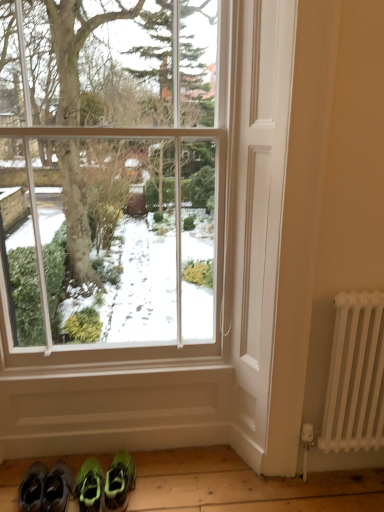
What do you see at coordinates (119, 482) in the screenshot? I see `green synthetic sneakers at lower center, the first footwear positioned from the right` at bounding box center [119, 482].

The image size is (384, 512). Describe the element at coordinates (57, 488) in the screenshot. I see `green suede sneakers at lower left, which is the first footwear from left to right` at that location.

This screenshot has height=512, width=384. I want to click on green suede sneakers at lower left, the third footwear viewed from the right, so click(x=57, y=488).

What do you see at coordinates (355, 375) in the screenshot? I see `white metal radiator at right` at bounding box center [355, 375].

Find the location of a particular element. This screenshot has height=512, width=384. white metal radiator at right is located at coordinates pos(355,375).

The height and width of the screenshot is (512, 384). What are the coordinates of `green suede sneakers at lower left, the second footwear in the right-to-left sequence` in the screenshot? It's located at (89, 486).

The image size is (384, 512). In order to click on green synthetic sneakers at lower center, the first footwear positioned from the right in this screenshot , I will do `click(119, 482)`.

Does green synthetic sneakers at lower center, the first footwear positioned from the right, turn towards green suede sneakers at lower left, which is the first footwear from left to right?

No, green synthetic sneakers at lower center, the first footwear positioned from the right, is not aimed at green suede sneakers at lower left, which is the first footwear from left to right.

Which point is more forward, (x=115, y=489) or (x=53, y=470)?

Positioned in front is point (x=115, y=489).

The height and width of the screenshot is (512, 384). What are the coordinates of `radiator on the right of the green suede sneakers at lower left, which is the first footwear from left to right` in the screenshot? It's located at (355, 375).

Is green suede sneakers at lower left, which is the first footwear from left to right, facing away from white metal radiator at right?

No, green suede sneakers at lower left, which is the first footwear from left to right, is not facing away from white metal radiator at right.

What's the angular difference between green suede sneakers at lower left, which is the first footwear from left to right, and white metal radiator at right's facing directions?

6.03 degrees.

Does green suede sneakers at lower left, which is the first footwear from left to right, have a greater height compared to white metal radiator at right?

Incorrect, the height of green suede sneakers at lower left, which is the first footwear from left to right, is not larger of that of white metal radiator at right.

In the image, is white metal radiator at right on the left side or the right side of green suede sneakers at lower left, the second footwear in the right-to-left sequence?

In the image, white metal radiator at right appears on the right side of green suede sneakers at lower left, the second footwear in the right-to-left sequence.

Is white metal radiator at right far from green suede sneakers at lower left, the second footwear in the right-to-left sequence?

Absolutely, white metal radiator at right is distant from green suede sneakers at lower left, the second footwear in the right-to-left sequence.

Could green suede sneakers at lower left, the second footwear in the right-to-left sequence, be considered to be inside white metal radiator at right?

No, white metal radiator at right does not contain green suede sneakers at lower left, the second footwear in the right-to-left sequence.

From the image's perspective, is green suede sneakers at lower left, the second footwear in the right-to-left sequence, above or below white metal radiator at right?

green suede sneakers at lower left, the second footwear in the right-to-left sequence, is situated lower than white metal radiator at right in the image.

In the scene shown: Considering the relative sizes of green suede sneakers at lower left, the second footwear in the right-to-left sequence, and white metal radiator at right in the image provided, is green suede sneakers at lower left, the second footwear in the right-to-left sequence, bigger than white metal radiator at right?

Incorrect, green suede sneakers at lower left, the second footwear in the right-to-left sequence, is not larger than white metal radiator at right.

The height and width of the screenshot is (512, 384). Find the location of `radiator in front of the green suede sneakers at lower left, the second footwear in the right-to-left sequence`. radiator in front of the green suede sneakers at lower left, the second footwear in the right-to-left sequence is located at coordinates (355, 375).

Could you tell me if green suede sneakers at lower left, the second footwear in the right-to-left sequence, is turned towards white metal radiator at right?

No.

Is white metal radiator at right further to camera compared to green synthetic sneakers at lower center, the first footwear positioned from the right?

No, it is in front of green synthetic sneakers at lower center, the first footwear positioned from the right.

From the picture: From the image's perspective, is white metal radiator at right above or below green synthetic sneakers at lower center, the first footwear positioned from the right?

Based on their image positions, white metal radiator at right is located above green synthetic sneakers at lower center, the first footwear positioned from the right.

From a real-world perspective, is white metal radiator at right located higher than green synthetic sneakers at lower center, marked as the third footwear in a left-to-right arrangement?

Correct, in the physical world, white metal radiator at right is higher than green synthetic sneakers at lower center, marked as the third footwear in a left-to-right arrangement.

Considering the positions of point (329, 399) and point (127, 463), is point (329, 399) closer or farther from the camera than point (127, 463)?

Point (329, 399) is closer to the camera than point (127, 463).

Image resolution: width=384 pixels, height=512 pixels. In the image, there is a green suede sneakers at lower left, the third footwear viewed from the right. Identify the location of footwear below it (from the image's perspective). (89, 486).

Between green suede sneakers at lower left, the second footwear in the right-to-left sequence, and green suede sneakers at lower left, which is the first footwear from left to right, which one has larger width?

Wider between the two is green suede sneakers at lower left, the second footwear in the right-to-left sequence.

Based on their positions, is green suede sneakers at lower left, which appears as the 2th footwear when viewed from the left, located to the left or right of green suede sneakers at lower left, which is the first footwear from left to right?

green suede sneakers at lower left, which appears as the 2th footwear when viewed from the left, is to the right of green suede sneakers at lower left, which is the first footwear from left to right.

Considering the relative sizes of green suede sneakers at lower left, which is the first footwear from left to right, and green suede sneakers at lower left, which appears as the 2th footwear when viewed from the left, in the image provided, is green suede sneakers at lower left, which is the first footwear from left to right, bigger than green suede sneakers at lower left, which appears as the 2th footwear when viewed from the left,?

Yes, green suede sneakers at lower left, which is the first footwear from left to right, is bigger than green suede sneakers at lower left, which appears as the 2th footwear when viewed from the left.

The width and height of the screenshot is (384, 512). What are the coordinates of `footwear to the left of green suede sneakers at lower left, the second footwear in the right-to-left sequence` in the screenshot? It's located at (57, 488).

Considering their positions, is green suede sneakers at lower left, the third footwear viewed from the right, located in front of or behind green suede sneakers at lower left, the second footwear in the right-to-left sequence?

Clearly, green suede sneakers at lower left, the third footwear viewed from the right, is in front of green suede sneakers at lower left, the second footwear in the right-to-left sequence.

From the image's perspective, which is above, green suede sneakers at lower left, the third footwear viewed from the right, or green suede sneakers at lower left, which appears as the 2th footwear when viewed from the left?

green suede sneakers at lower left, the third footwear viewed from the right, is shown above in the image.

Where is `the 2nd footwear behind the green suede sneakers at lower left, which is the first footwear from left to right, counting from the anchor's position`? This screenshot has width=384, height=512. the 2nd footwear behind the green suede sneakers at lower left, which is the first footwear from left to right, counting from the anchor's position is located at coordinates (119, 482).

This screenshot has width=384, height=512. Identify the location of the 1st footwear below the white metal radiator at right (from a real-world perspective). 57,488.

Which object lies further to the anchor point green suede sneakers at lower left, which is the first footwear from left to right, green synthetic sneakers at lower center, marked as the third footwear in a left-to-right arrangement, or white metal radiator at right?

Based on the image, white metal radiator at right appears to be further to green suede sneakers at lower left, which is the first footwear from left to right.

Based on their spatial positions, is white metal radiator at right or green suede sneakers at lower left, which is the first footwear from left to right, closer to green suede sneakers at lower left, the second footwear in the right-to-left sequence?

green suede sneakers at lower left, which is the first footwear from left to right, lies closer to green suede sneakers at lower left, the second footwear in the right-to-left sequence, than the other object.

When comparing their distances from white metal radiator at right, does clear glass window at center or green suede sneakers at lower left, the second footwear in the right-to-left sequence, seem further?

The object further to white metal radiator at right is green suede sneakers at lower left, the second footwear in the right-to-left sequence.

When comparing their distances from clear glass window at center, does green synthetic sneakers at lower center, the first footwear positioned from the right, or green suede sneakers at lower left, the second footwear in the right-to-left sequence, seem closer?

green synthetic sneakers at lower center, the first footwear positioned from the right, is closer to clear glass window at center.

Based on their spatial positions, is green suede sneakers at lower left, the third footwear viewed from the right, or white metal radiator at right further from clear glass window at center?

Based on the image, green suede sneakers at lower left, the third footwear viewed from the right, appears to be further to clear glass window at center.

When comparing their distances from green suede sneakers at lower left, the second footwear in the right-to-left sequence, does white metal radiator at right or clear glass window at center seem closer?

white metal radiator at right is closer to green suede sneakers at lower left, the second footwear in the right-to-left sequence.

Looking at the image, which one is located further to green synthetic sneakers at lower center, marked as the third footwear in a left-to-right arrangement, white metal radiator at right or green suede sneakers at lower left, the third footwear viewed from the right?

Among the two, white metal radiator at right is located further to green synthetic sneakers at lower center, marked as the third footwear in a left-to-right arrangement.

Which object lies nearer to the anchor point green suede sneakers at lower left, which is the first footwear from left to right, green synthetic sneakers at lower center, the first footwear positioned from the right, or clear glass window at center?

green synthetic sneakers at lower center, the first footwear positioned from the right, is closer to green suede sneakers at lower left, which is the first footwear from left to right.

Locate an element on the screen. This screenshot has width=384, height=512. window between green suede sneakers at lower left, which is the first footwear from left to right, and white metal radiator at right, in the horizontal direction is located at coordinates (113, 174).

Where is `window between green suede sneakers at lower left, the second footwear in the right-to-left sequence, and white metal radiator at right from left to right`? The height and width of the screenshot is (512, 384). window between green suede sneakers at lower left, the second footwear in the right-to-left sequence, and white metal radiator at right from left to right is located at coordinates (113, 174).

You are a GUI agent. You are given a task and a screenshot of the screen. Output one action in this format:
    pyautogui.click(x=<x>, y=<y>)
    Task: Click on the footwear between green suede sneakers at lower left, which is the first footwear from left to right, and green synthetic sneakers at lower center, the first footwear positioned from the right
    
    Given the screenshot: What is the action you would take?
    coord(89,486)

The width and height of the screenshot is (384, 512). I want to click on footwear between clear glass window at center and green suede sneakers at lower left, the third footwear viewed from the right, in the vertical direction, so click(x=119, y=482).